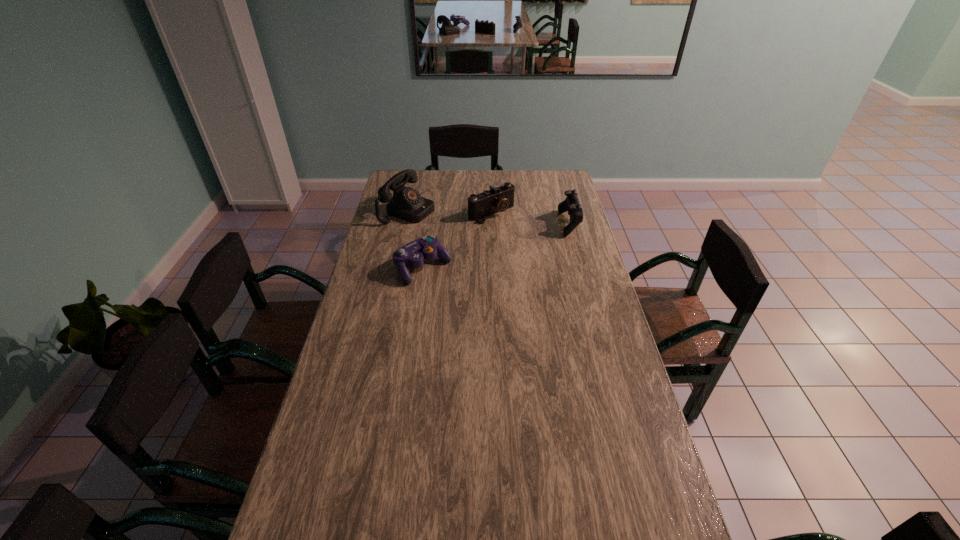
In order to click on blank space at the far right corner of the desktop in this screenshot , I will do `click(550, 180)`.

The width and height of the screenshot is (960, 540). What are the coordinates of `vacant space that is in between the camera and the tallest object` in the screenshot? It's located at (450, 212).

I want to click on vacant space that's between the left control and the second object from right to left, so click(457, 240).

In order to click on free spot between the rightmost object and the tallest object in this screenshot , I will do `click(490, 217)`.

At what (x,y) coordinates should I click in order to perform the action: click on free space between the nearest object and the telephone. Please return your answer as a coordinate pair (x, y). Looking at the image, I should click on (416, 239).

Find the location of a particular element. The width and height of the screenshot is (960, 540). free space between the tallest object and the right control is located at coordinates (490, 217).

Where is `free spot between the rightmost object and the telephone`? This screenshot has width=960, height=540. free spot between the rightmost object and the telephone is located at coordinates (490, 217).

I want to click on vacant region between the shortest object and the tallest object, so click(416, 239).

Where is `vacant area that lies between the third object from left to right and the telephone`? Image resolution: width=960 pixels, height=540 pixels. vacant area that lies between the third object from left to right and the telephone is located at coordinates (450, 212).

Identify the location of free point between the tallest object and the shortest object. (416, 239).